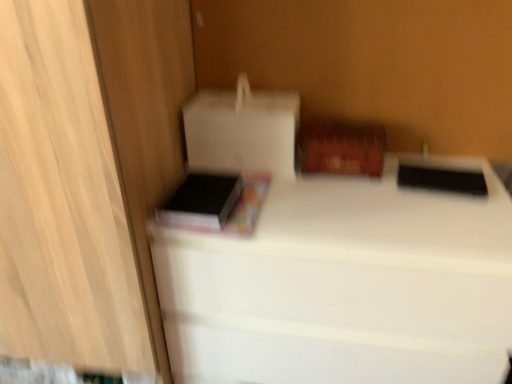
Question: Considering the positions of black matte book at left and white matte cardboard box at upper left, marked as the 2th cardboard box in a right-to-left arrangement, in the image, is black matte book at left wider or thinner than white matte cardboard box at upper left, marked as the 2th cardboard box in a right-to-left arrangement,?

Choices:
 (A) wide
 (B) thin

Answer: (A)

Question: Is point (241, 177) closer or farther from the camera than point (204, 129)?

Choices:
 (A) closer
 (B) farther

Answer: (B)

Question: Which of these objects is positioned closest to the cardboard box at upper right, marked as the 1th cardboard box in a right-to-left arrangement?

Choices:
 (A) white matte bed at center
 (B) black matte book at left
 (C) white matte cardboard box at upper left, which is counted as the first cardboard box, starting from the left
 (D) matte wood cabinet at left

Answer: (C)

Question: Considering the real-world distances, which object is farthest from the cardboard box at upper right, marked as the 1th cardboard box in a right-to-left arrangement?

Choices:
 (A) matte wood cabinet at left
 (B) white matte cardboard box at upper left, which is counted as the first cardboard box, starting from the left
 (C) black matte book at left
 (D) white matte bed at center

Answer: (A)